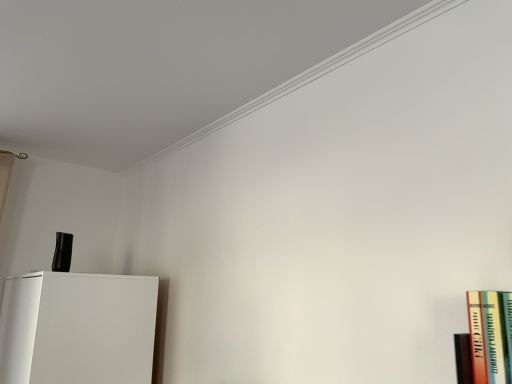
Question: Is white matte cabinet at lower left at the left side of hardcover book at right?

Choices:
 (A) no
 (B) yes

Answer: (B)

Question: Is white matte cabinet at lower left positioned beyond the bounds of hardcover book at right?

Choices:
 (A) no
 (B) yes

Answer: (B)

Question: Is white matte cabinet at lower left positioned before hardcover book at right?

Choices:
 (A) no
 (B) yes

Answer: (A)

Question: Considering the relative sizes of white matte cabinet at lower left and hardcover book at right in the image provided, is white matte cabinet at lower left thinner than hardcover book at right?

Choices:
 (A) no
 (B) yes

Answer: (A)

Question: Is white matte cabinet at lower left facing away from hardcover book at right?

Choices:
 (A) yes
 (B) no

Answer: (B)

Question: Considering the relative sizes of white matte cabinet at lower left and hardcover book at right in the image provided, is white matte cabinet at lower left smaller than hardcover book at right?

Choices:
 (A) no
 (B) yes

Answer: (A)

Question: Does hardcover book at right have a greater width compared to white matte cabinet at lower left?

Choices:
 (A) no
 (B) yes

Answer: (A)

Question: Does hardcover book at right appear on the right side of white matte cabinet at lower left?

Choices:
 (A) yes
 (B) no

Answer: (A)

Question: From a real-world perspective, is hardcover book at right beneath white matte cabinet at lower left?

Choices:
 (A) no
 (B) yes

Answer: (A)

Question: Considering the relative sizes of hardcover book at right and white matte cabinet at lower left in the image provided, is hardcover book at right thinner than white matte cabinet at lower left?

Choices:
 (A) yes
 (B) no

Answer: (A)

Question: Can you confirm if hardcover book at right is taller than white matte cabinet at lower left?

Choices:
 (A) no
 (B) yes

Answer: (A)

Question: From a real-world perspective, is hardcover book at right over white matte cabinet at lower left?

Choices:
 (A) yes
 (B) no

Answer: (A)

Question: Looking at the image, does white matte cabinet at lower left seem bigger or smaller compared to hardcover book at right?

Choices:
 (A) big
 (B) small

Answer: (A)